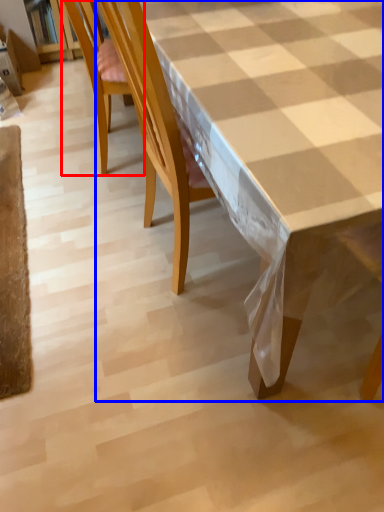
Question: Which point is further to the camera, chair (highlighted by a red box) or table (highlighted by a blue box)?

Choices:
 (A) chair
 (B) table

Answer: (A)